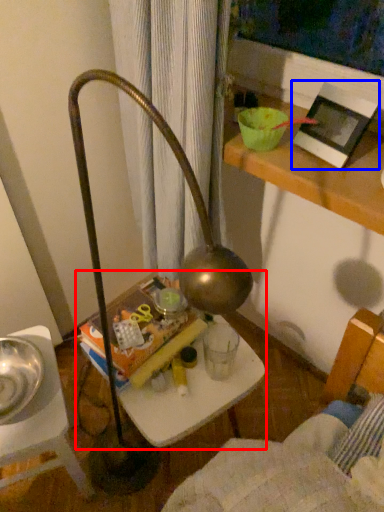
Question: Among these objects, which one is farthest to the camera, table (highlighted by a red box) or picture frame (highlighted by a blue box)?

Choices:
 (A) table
 (B) picture frame

Answer: (A)